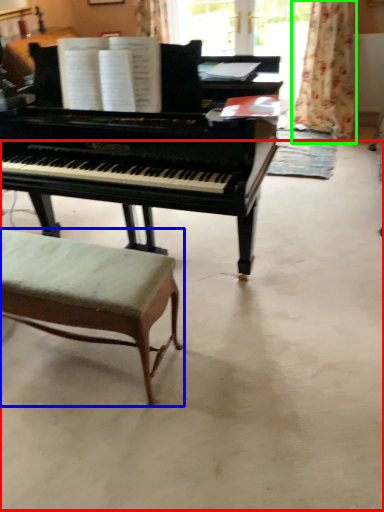
Question: Estimate the real-world distances between objects in this image. Which object is farther from concrete (highlighted by a red box), stool (highlighted by a blue box) or curtain (highlighted by a green box)?

Choices:
 (A) stool
 (B) curtain

Answer: (B)